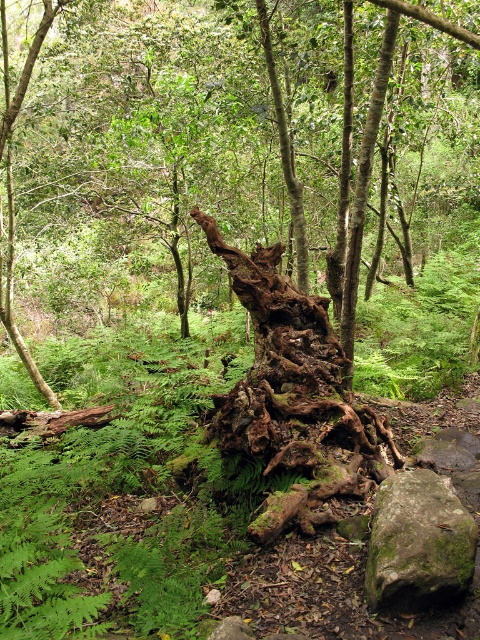
Question: Which point is closer to the camera?

Choices:
 (A) rusty wood tree trunk at center
 (B) green mossy rock at lower right

Answer: (B)

Question: Is rusty wood log at center smaller than rusty wood tree trunk at center?

Choices:
 (A) no
 (B) yes

Answer: (A)

Question: Can you confirm if rusty wood tree trunk at center is positioned below green mossy rock at lower right?

Choices:
 (A) yes
 (B) no

Answer: (B)

Question: Where is rusty wood tree trunk at center located in relation to green mossy rock at lower right in the image?

Choices:
 (A) left
 (B) right

Answer: (A)

Question: Which point is closer to the camera?

Choices:
 (A) (325, 435)
 (B) (416, 499)
 (C) (158, 163)

Answer: (B)

Question: Among these objects, which one is nearest to the camera?

Choices:
 (A) rusty wood log at center
 (B) rusty wood tree trunk at center

Answer: (A)